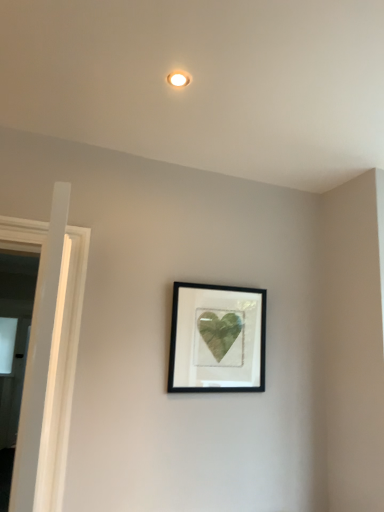
Measure the distance between point (240,307) and camera.

Point (240,307) is 2.29 meters from camera.

At what (x,y) coordinates should I click in order to perform the action: click on matte black picture frame at center. Please return your answer as a coordinate pair (x, y). The width and height of the screenshot is (384, 512). Looking at the image, I should click on (217, 339).

What is the approximate height of matte black picture frame at center?

matte black picture frame at center is 59.75 centimeters tall.

What do you see at coordinates (217, 339) in the screenshot?
I see `matte black picture frame at center` at bounding box center [217, 339].

The height and width of the screenshot is (512, 384). Find the location of `matte black picture frame at center`. matte black picture frame at center is located at coordinates (217, 339).